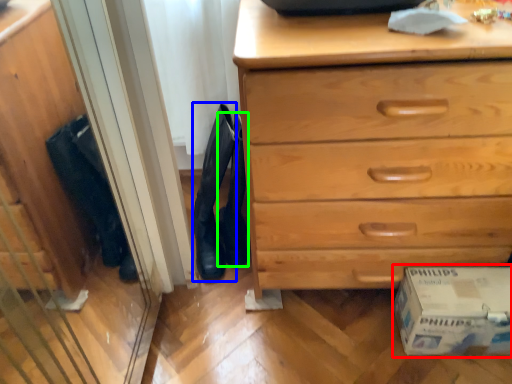
Question: Estimate the real-world distances between objects in this image. Which object is closer to cardboard box (highlighted by a red box), boot (highlighted by a blue box) or shoe (highlighted by a green box)?

Choices:
 (A) boot
 (B) shoe

Answer: (B)